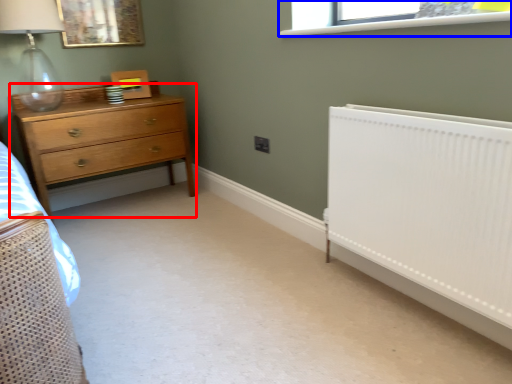
Question: Which point is closer to the camera, chest of drawers (highlighted by a red box) or window (highlighted by a blue box)?

Choices:
 (A) chest of drawers
 (B) window

Answer: (B)